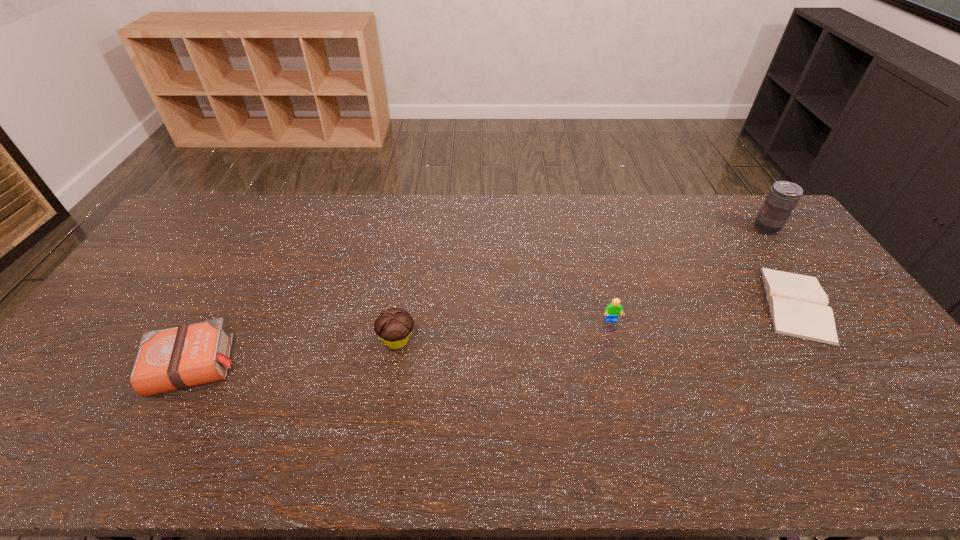
Locate an element on the screen. This screenshot has height=540, width=960. telephoto lens is located at coordinates (783, 196).

The width and height of the screenshot is (960, 540). I want to click on the tallest object, so click(x=783, y=196).

What are the coordinates of `muffin` in the screenshot? It's located at 394,325.

Find the location of a particular element. The height and width of the screenshot is (540, 960). Lego is located at coordinates (x=613, y=309).

Where is `the left Bible`? the left Bible is located at coordinates (178, 358).

The width and height of the screenshot is (960, 540). Identify the location of the leftmost object. (178, 358).

I want to click on the shortest object, so click(x=798, y=305).

The image size is (960, 540). What are the coordinates of `the right Bible` in the screenshot? It's located at (798, 305).

Identify the location of blank space located on the side of the telephoto lens where the control switches are located. Image resolution: width=960 pixels, height=540 pixels. (705, 228).

Image resolution: width=960 pixels, height=540 pixels. Identify the location of vacant space positioned 0.360m on the side of the telephoto lens where the control switches are located. (651, 228).